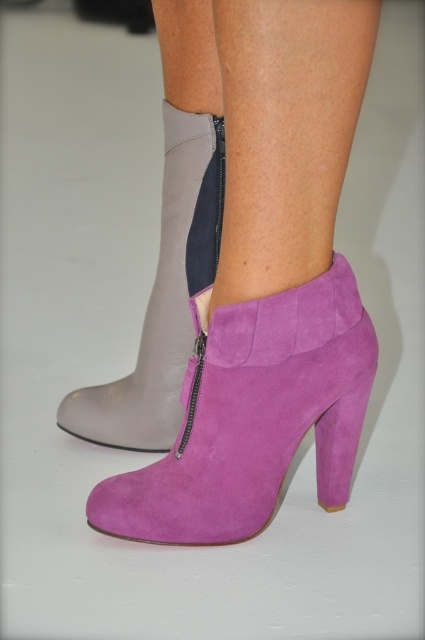
You are taking a photo of two points in the scene. The points are labeled as point [232,380] and point [192,230]. Which point will appear larger in your photo?

Point [232,380] is closer to the camera than point [192,230], so it will appear larger in the photo.

You are an AI analyzing the position of the purple suede boot at lower right in the image. What are the coordinates of its position?

The purple suede boot at lower right is located at coordinates point (243,275).

You are a fashion designer examining the image of two boots. You notice the purple suede boot at lower right and the purple suede heel at lower right. Which one is positioned to the left of the other?

The purple suede boot at lower right is positioned to the left of the purple suede heel at lower right.